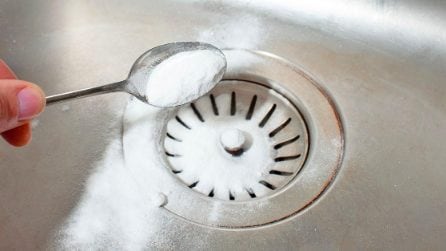
At what (x,y) coordinates should I click in order to perform the action: click on spoon. Please return your answer as a coordinate pair (x, y). The height and width of the screenshot is (251, 446). Looking at the image, I should click on (105, 88), (136, 81).